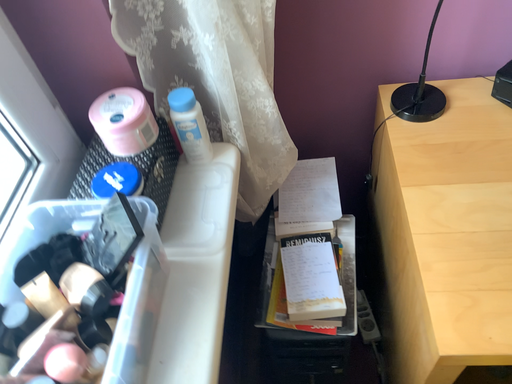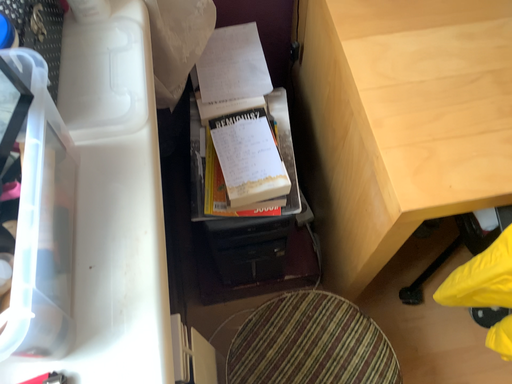
Question: Which way did the camera rotate in the video?

Choices:
 (A) rotated upward
 (B) rotated downward

Answer: (B)